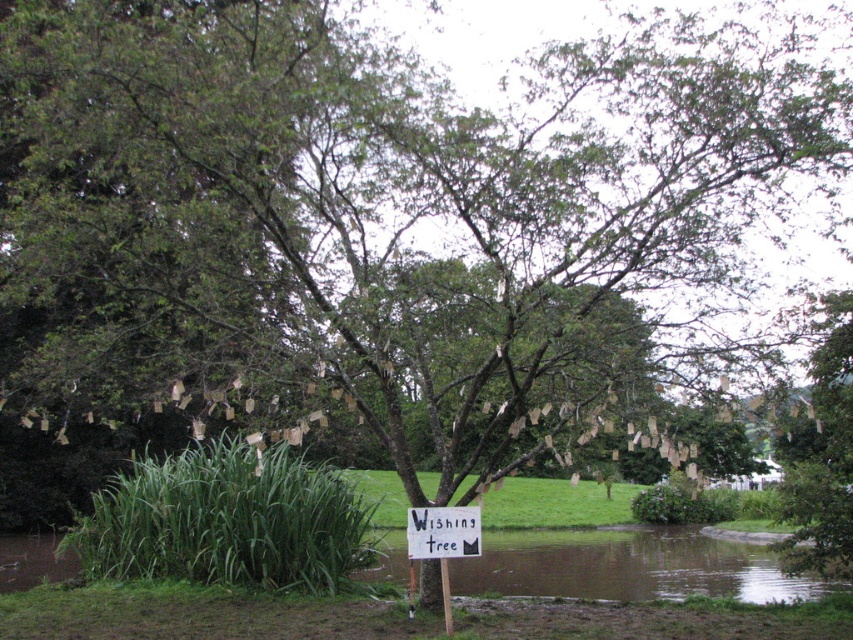
In the scene shown: Is brown murky water at lower center thinner than green leafy tree at upper right?

In fact, brown murky water at lower center might be wider than green leafy tree at upper right.

Which is behind, point (636, 561) or point (840, 536)?

Positioned behind is point (636, 561).

Locate an element on the screen. The image size is (853, 640). brown murky water at lower center is located at coordinates (627, 566).

Who is positioned more to the right, green leafy tree at upper right or white paper sign at center?

Positioned to the right is green leafy tree at upper right.

Does green leafy tree at upper right have a larger size compared to white paper sign at center?

Yes, green leafy tree at upper right is bigger than white paper sign at center.

Which is behind, point (816, 532) or point (415, 556)?

The point (816, 532) is behind.

Locate an element on the screen. This screenshot has width=853, height=640. green leafy tree at upper right is located at coordinates (821, 452).

Can you confirm if brown murky water at lower center is smaller than white paper sign at center?

Actually, brown murky water at lower center might be larger than white paper sign at center.

Is point (596, 579) positioned after point (447, 518)?

Yes, point (596, 579) is behind point (447, 518).

You are a GUI agent. You are given a task and a screenshot of the screen. Output one action in this format:
    pyautogui.click(x=<x>, y=<y>)
    Task: Click on the brown murky water at lower center
    The width and height of the screenshot is (853, 640).
    Given the screenshot: What is the action you would take?
    [627, 566]